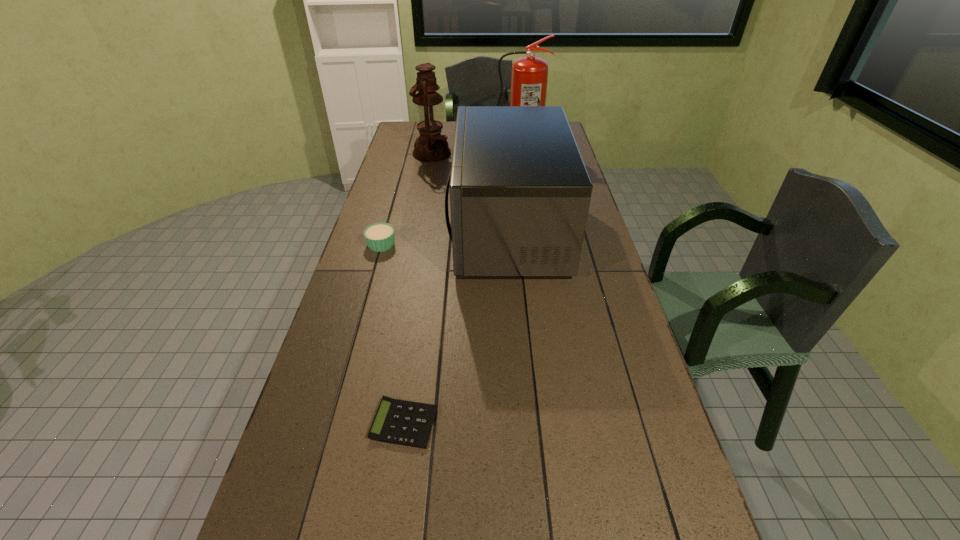
This screenshot has width=960, height=540. What are the coordinates of `vacant space that is in between the nearest object and the oil lamp` in the screenshot? It's located at (418, 288).

This screenshot has width=960, height=540. I want to click on vacant area that lies between the tallest object and the calculator, so click(x=460, y=287).

This screenshot has width=960, height=540. Identify the location of vacant area that lies between the microwave oven and the second shortest object. (444, 237).

Locate an element on the screen. The image size is (960, 540). unoccupied position between the microwave oven and the nearest object is located at coordinates (456, 326).

This screenshot has width=960, height=540. Identify the location of vacant space in between the calculator and the tallest object. (460, 287).

The image size is (960, 540). I want to click on free point between the microwave oven and the fourth tallest object, so click(444, 237).

You are a GUI agent. You are given a task and a screenshot of the screen. Output one action in this format:
    pyautogui.click(x=<x>, y=<y>)
    Task: Click on the fourth closest object to the tallest object
    This screenshot has width=960, height=540.
    Given the screenshot: What is the action you would take?
    tap(400, 422)

Choose which object is the nearest neighbor to the microwave oven. Please provide its 2D coordinates. Your answer should be formatted as a tuple, i.e. [(x, y)], where the tuple contains the x and y coordinates of a point satisfying the conditions above.

[(379, 237)]

Where is `vacant space that satisfies the following two spatial constraints: 1. on the front side of the calculator; 2. on the right side of the fourth tallest object`? The height and width of the screenshot is (540, 960). vacant space that satisfies the following two spatial constraints: 1. on the front side of the calculator; 2. on the right side of the fourth tallest object is located at coordinates (330, 423).

Find the location of a particular element. vacant space that satisfies the following two spatial constraints: 1. on the instruction side of the fire extinguisher; 2. on the front-facing side of the microwave oven is located at coordinates (528, 230).